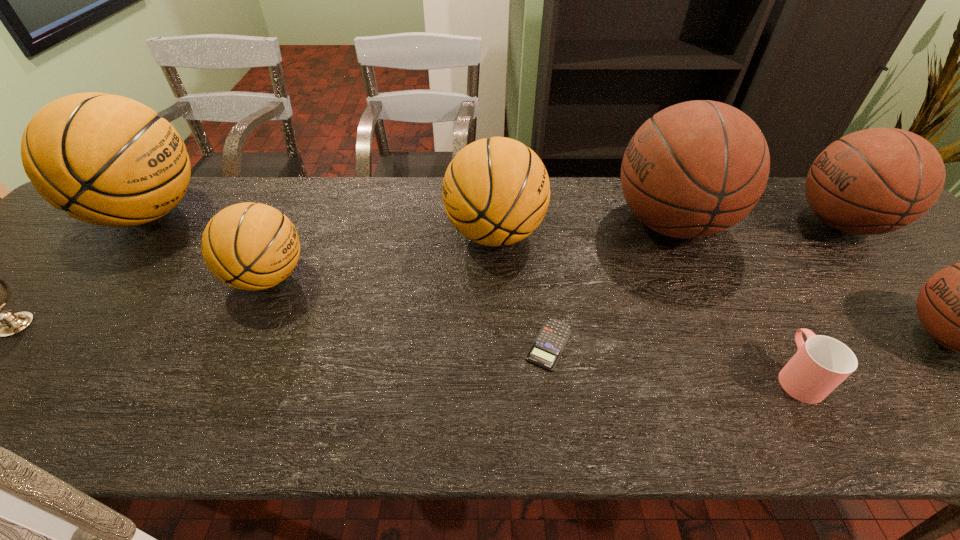
Where is `object that is at the far left corner`? This screenshot has height=540, width=960. object that is at the far left corner is located at coordinates click(108, 160).

Where is `object that is positioned at the far right corner`? The width and height of the screenshot is (960, 540). object that is positioned at the far right corner is located at coordinates (878, 180).

Locate an element on the screen. free region at the far edge of the desktop is located at coordinates (314, 207).

The height and width of the screenshot is (540, 960). In the image, there is a desktop. Find the location of `free space at the near edge`. free space at the near edge is located at coordinates (322, 407).

I want to click on vacant space at the left edge of the desktop, so click(x=108, y=239).

I want to click on blank space at the far left corner of the desktop, so click(x=78, y=228).

Locate an element on the screen. The height and width of the screenshot is (540, 960). vacant space in between the eighth tallest object and the leftmost basketball is located at coordinates (472, 295).

Find the location of `vacant point located between the eighth tallest object and the second biggest brown basketball`. vacant point located between the eighth tallest object and the second biggest brown basketball is located at coordinates (819, 300).

The height and width of the screenshot is (540, 960). I want to click on empty location between the leftmost brown basketball and the rightmost orange basketball, so click(x=583, y=228).

In order to click on the fourth closest object to the rightmost orange basketball in this screenshot , I will do `click(820, 364)`.